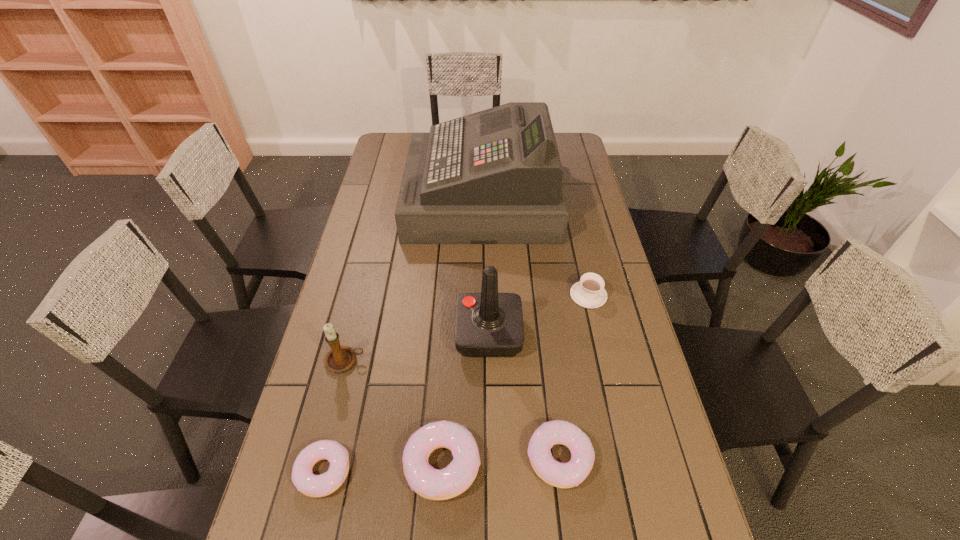
At what (x,y) coordinates should I click in order to perform the action: click on the leftmost doughnut. Please return your answer as a coordinate pair (x, y). This screenshot has width=960, height=540. Looking at the image, I should click on (311, 485).

You are a GUI agent. You are given a task and a screenshot of the screen. Output one action in this format:
    pyautogui.click(x=<x>, y=<y>)
    Task: Click on the shortest object
    
    Given the screenshot: What is the action you would take?
    pyautogui.click(x=311, y=485)

The image size is (960, 540). Find the location of `the second doughnut from left to right`. the second doughnut from left to right is located at coordinates (434, 484).

Where is `the second shortest doughnut`? The height and width of the screenshot is (540, 960). the second shortest doughnut is located at coordinates (562, 475).

I want to click on the farthest object, so click(492, 177).

Find the location of a particular element. cash register is located at coordinates (492, 177).

The height and width of the screenshot is (540, 960). I want to click on the second tallest object, so click(x=489, y=324).

Find the location of a particular element. candle holder is located at coordinates (341, 358).

What are the coordinates of `the second farthest object` in the screenshot? It's located at (589, 292).

I want to click on vacant space positioned 0.290m on the right of the shortest doughnut, so click(476, 471).